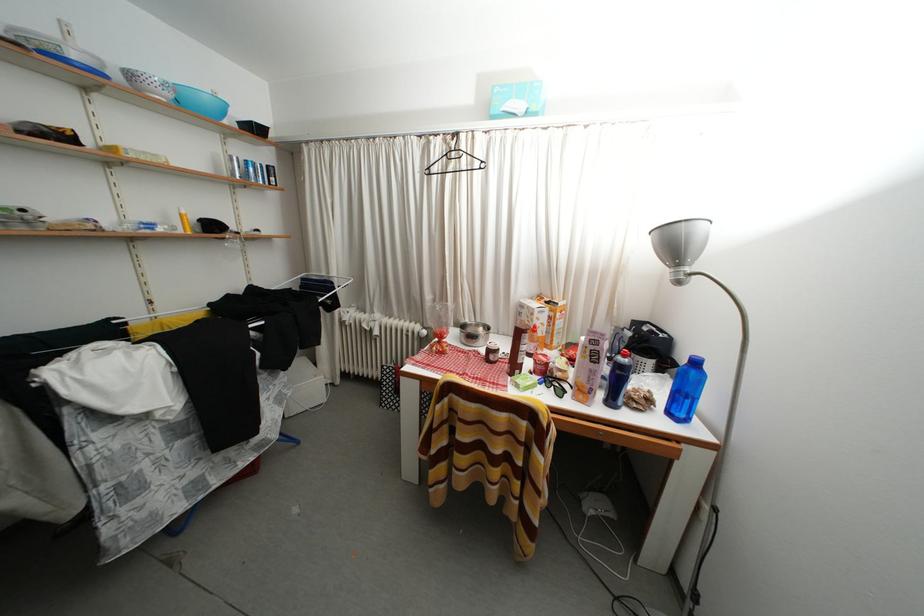
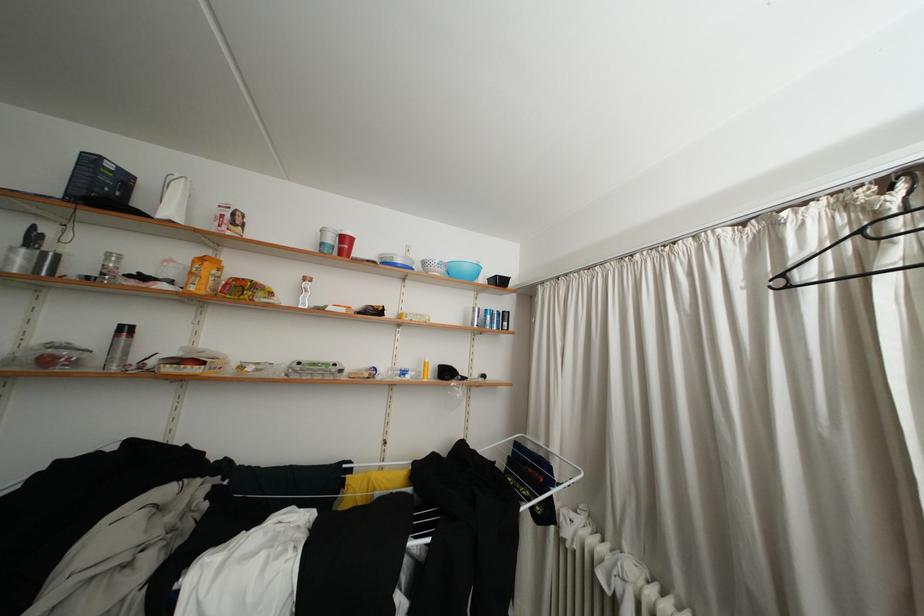
Where in the second image is the point corresponding to point (332, 280) from the first image?

(550, 448)